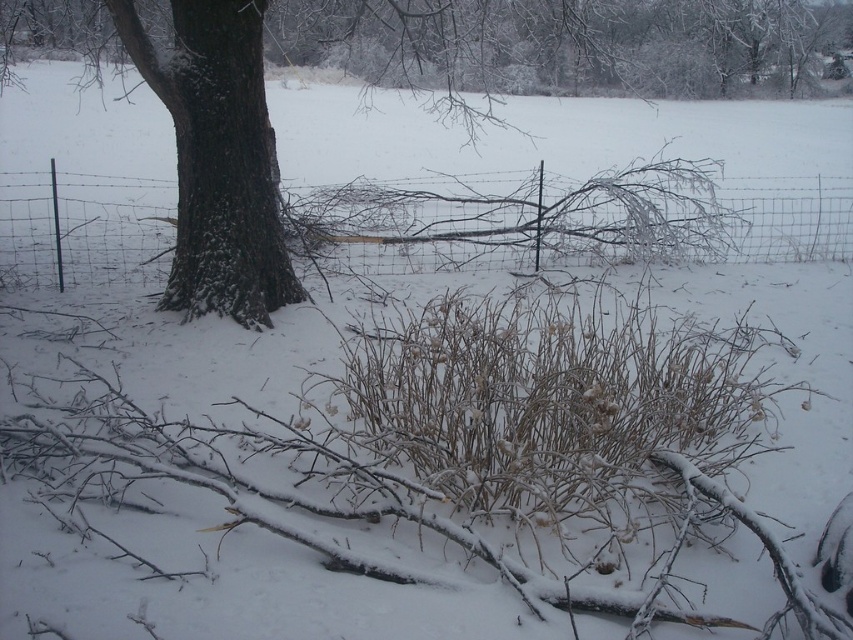
Question: Which point is farther to the camera?

Choices:
 (A) (809, 179)
 (B) (233, 298)

Answer: (A)

Question: Can you confirm if wire mesh fence at center is positioned to the left of brown rough bark tree at center?

Choices:
 (A) no
 (B) yes

Answer: (A)

Question: Which point is closer to the camera?

Choices:
 (A) brown rough bark tree at center
 (B) wire mesh fence at center

Answer: (A)

Question: Can you confirm if wire mesh fence at center is smaller than brown rough bark tree at center?

Choices:
 (A) no
 (B) yes

Answer: (A)

Question: Does wire mesh fence at center appear under brown rough bark tree at center?

Choices:
 (A) yes
 (B) no

Answer: (B)